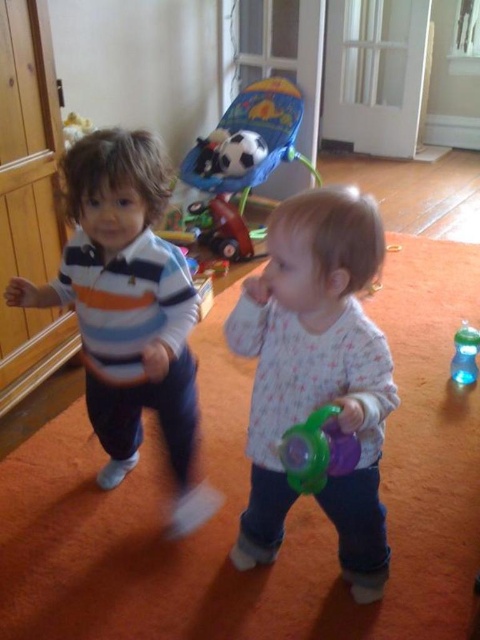
In the scene shown: You are a photographer standing in front of the striped cotton shirt at center. You want to take a closeup photo of the shirt without moving any objects. Can you reach it with your 1.2 meter long extendable pole?

The striped cotton shirt at center is 1.19 meters from viewer, so yes, the extendable pole can reach it since it is slightly shorter than the pole length.

You are a parent trying to decide which item to hand to your child first. The striped cotton shirt at center is part of their current outfit, and the translucent green sippy cup at center contains their drink. Considering their sizes, which item would you need to handle with more care to avoid dropping?

The striped cotton shirt at center is larger in size than the translucent green sippy cup at center, so the translucent green sippy cup at center is smaller and might require more care to avoid dropping due to its smaller size and potential fragility.

You are a parent trying to place a new toy between the striped cotton shirt at center and the plush fabric baby swing at upper center. The toy requires a minimum of 2 meters of space. Based on the image, can you fit the toy in that space?

The striped cotton shirt at center is 1.87 meters from the plush fabric baby swing at upper center. Since the required space is 2 meters, the toy cannot be placed between them as the available space is insufficient.